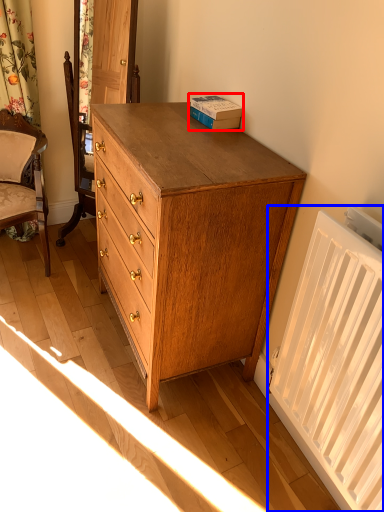
Question: Which point is closer to the camera, book (highlighted by a red box) or radiator (highlighted by a blue box)?

Choices:
 (A) book
 (B) radiator

Answer: (B)